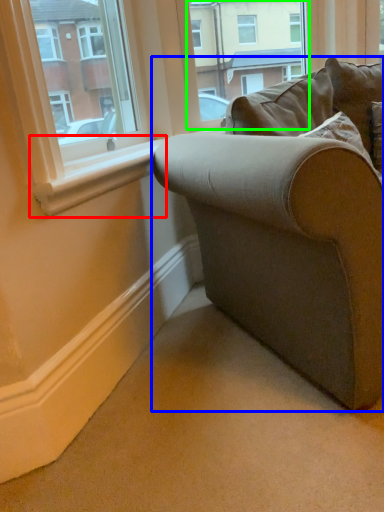
Question: Which object is positioned farthest from window sill (highlighted by a red box)? Select from studio couch (highlighted by a blue box) and window frame (highlighted by a green box).

Choices:
 (A) studio couch
 (B) window frame

Answer: (B)